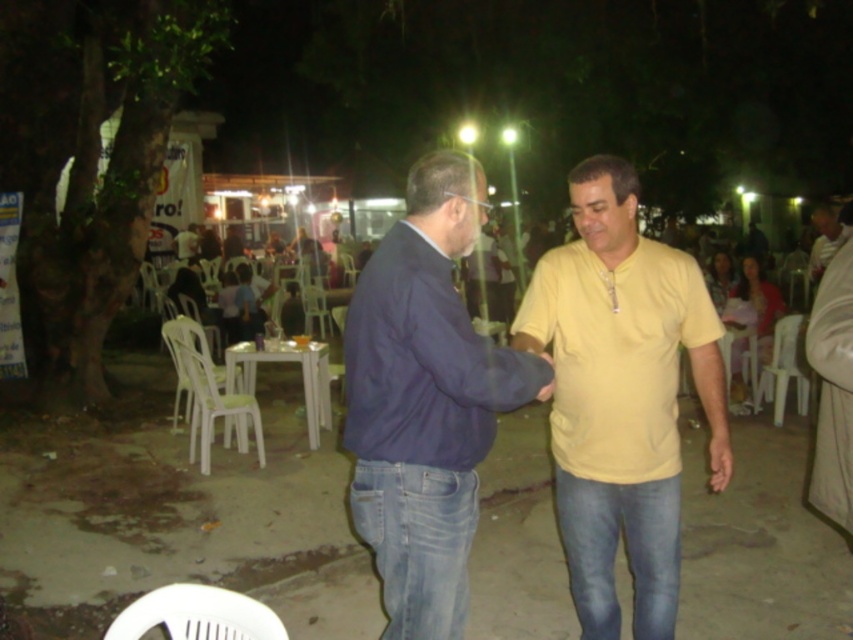
You are standing in the outdoor dining area and want to know which of the two points, point (587, 180) or point (404, 275), is closer to you. Can you determine this based on their positions?

Point (587, 180) is further to the camera than point (404, 275), so the point closer to you is point (404, 275).

You are a photographer at the event and want to capture a closeup of both the yellow matte shirt at center and the dark blue cotton shirt at center in the same frame. Given that your camera has a minimum focusing distance of 60 centimeters, will you be able to achieve this?

The yellow matte shirt at center and dark blue cotton shirt at center are 58.64 centimeters apart. Since the distance between them is less than the camera minimum focusing distance of 60 centimeters, you can move back slightly to ensure both are in focus and capture them in the same frame.